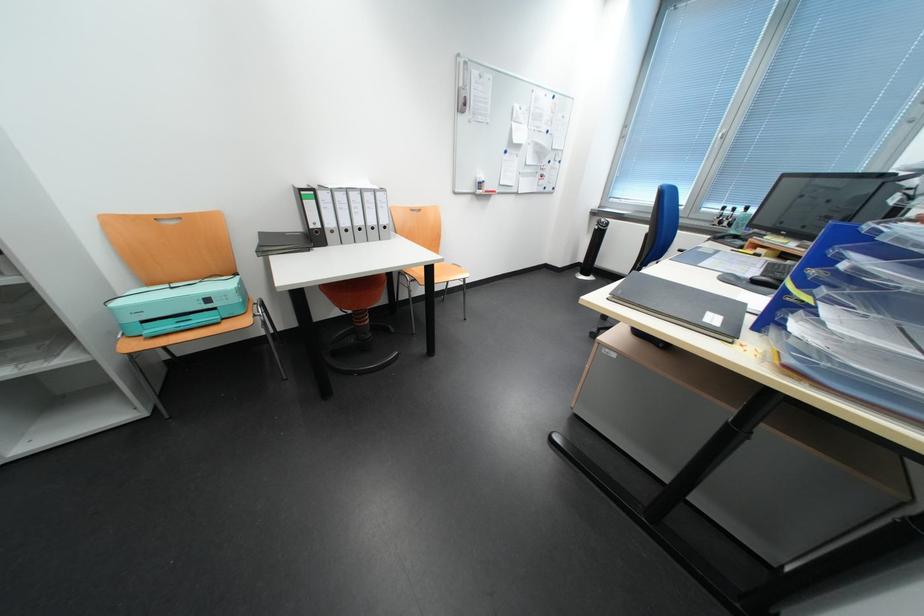
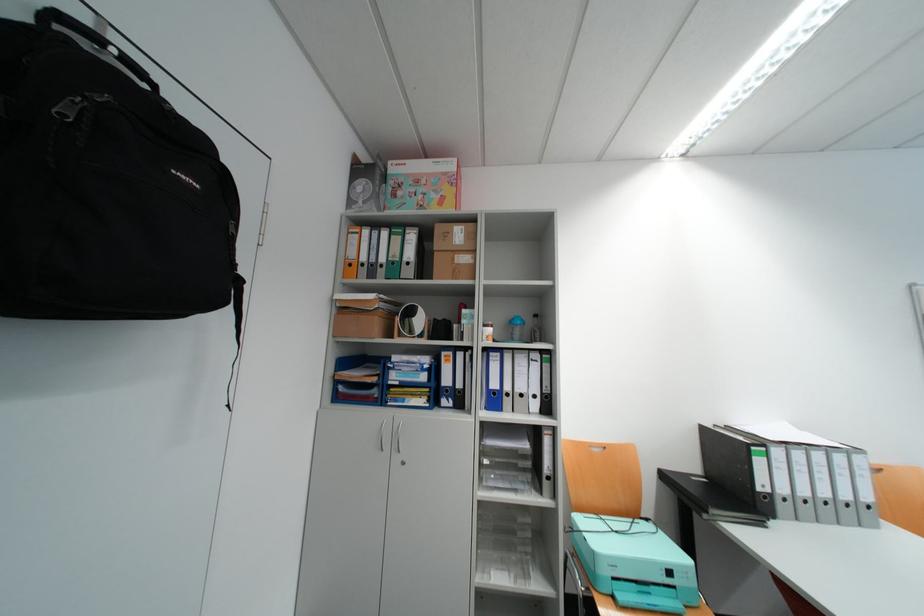
The point at (220, 302) is marked in the first image. Where is the corresponding point in the second image?

(682, 573)